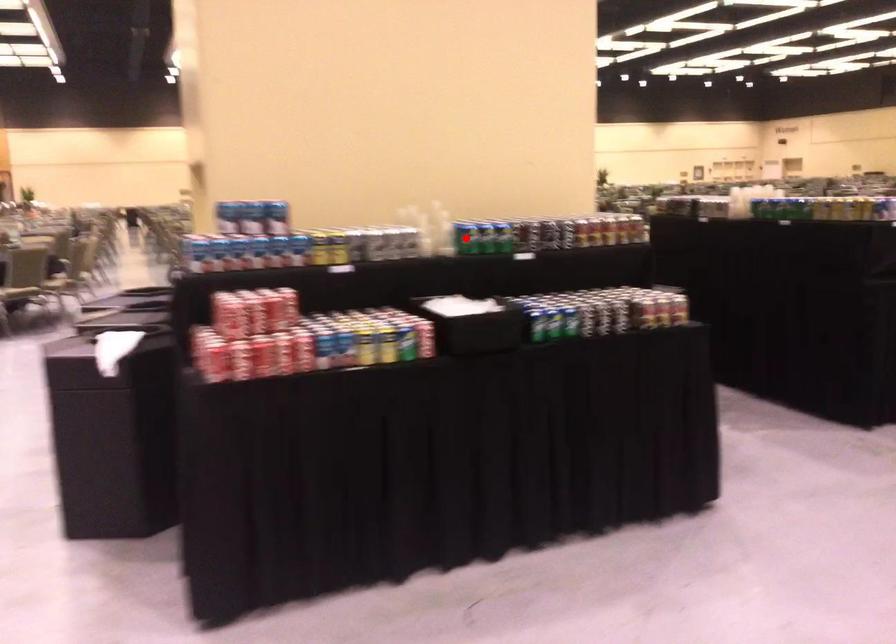
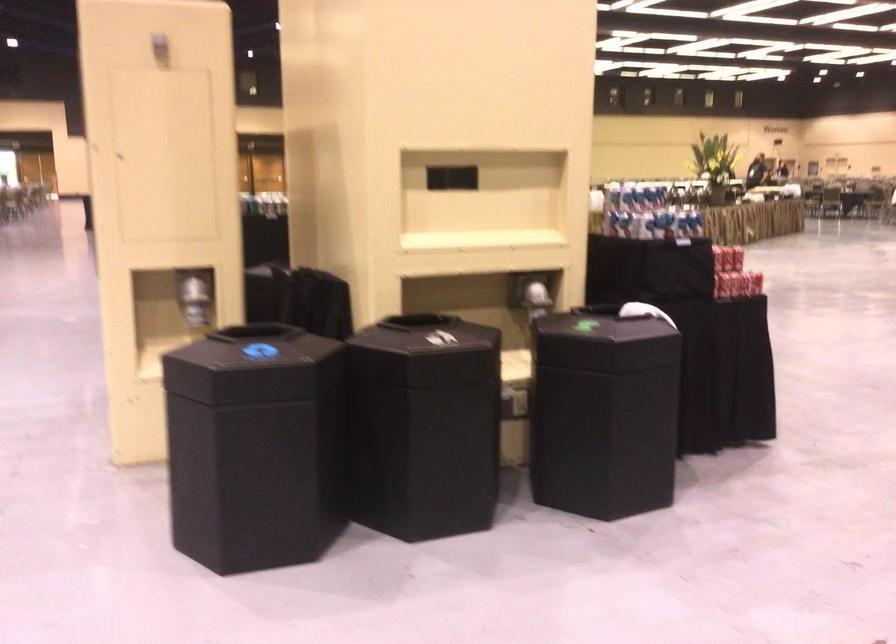
Question: I am providing you with two images of the same scene from different viewpoints. A red point is marked on the first image. Can you still see the location of the red point in image 2?

Choices:
 (A) Yes
 (B) No

Answer: (B)